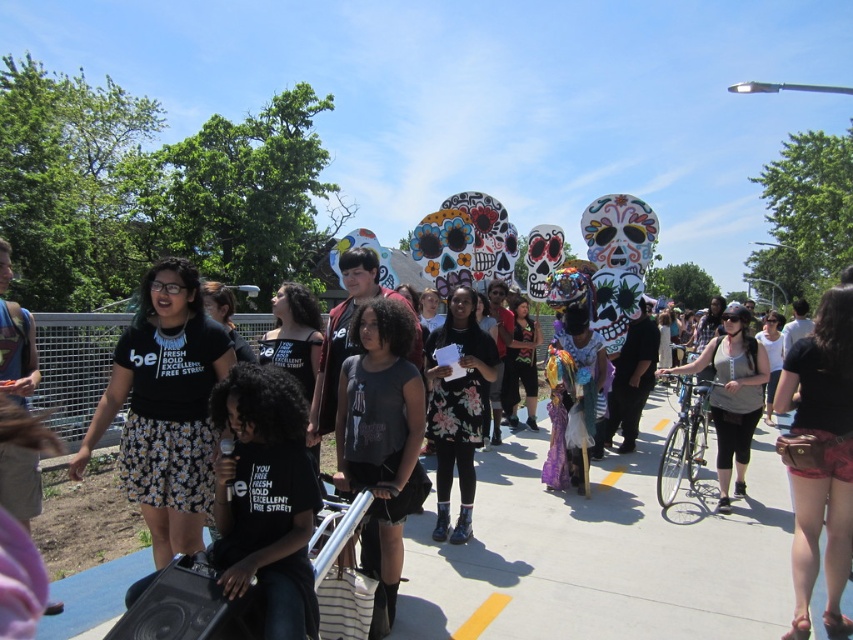
You are a photographer positioned at the center of the bridge, aiming to capture a photo that includes both the dark gray fabric shirt at center and the leather belt at lower right. Given that your camera has a maximum focus range of 8 feet, will both subjects be in focus?

The dark gray fabric shirt at center is 7.78 feet away from the leather belt at lower right. Since the maximum focus range is 8 feet, both subjects will be within the focus range and thus in focus.

You are standing on the pedestrian bridge and want to place a small potted plant between the gray concrete pavement at center and the black fabric shirt at center. According to the scene description, which object should the plant be closer to?

The gray concrete pavement at center is positioned on the right side of the black fabric shirt at center. Therefore, the potted plant should be placed closer to the gray concrete pavement at center to maintain the spatial arrangement described.

From the picture: You are a photographer at the event and want to capture a photo that includes both the leather belt at lower right and the floral dress at center. Based on their positions, which object should you focus on first to ensure both are in frame?

The leather belt at lower right is positioned on the right side of the floral dress at center, so focusing on the floral dress at center first will allow you to adjust the camera to include the leather belt at lower right within the frame.